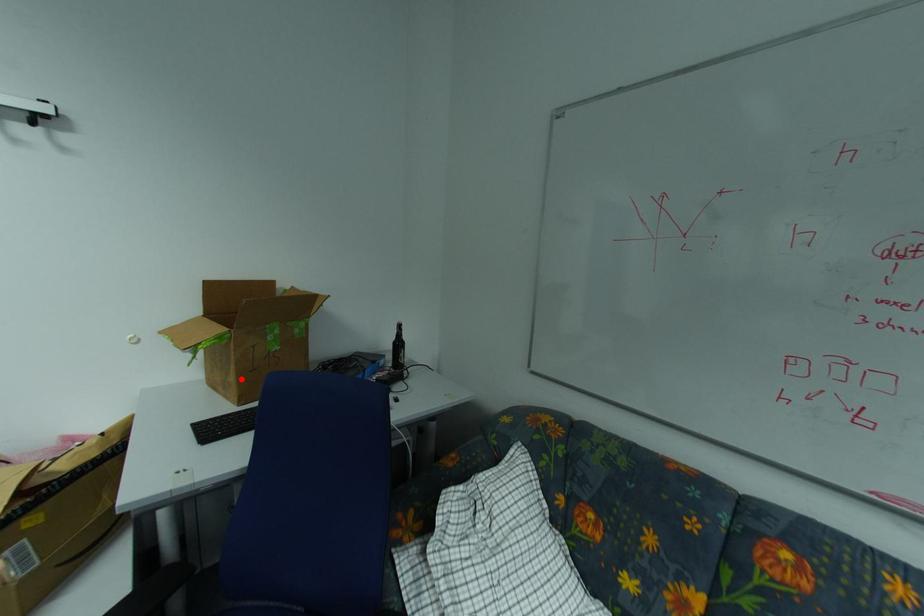
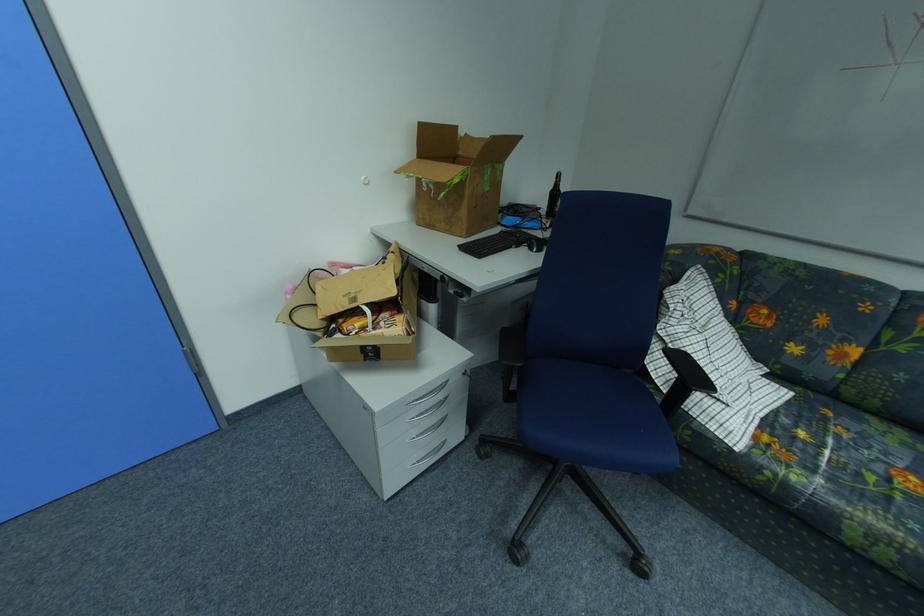
Question: I am providing you with two images of the same scene from different viewpoints. A red point is shown in image1. For the corresponding object point in image2, is it positioned nearer or farther from the camera?

Choices:
 (A) Nearer
 (B) Farther

Answer: (A)